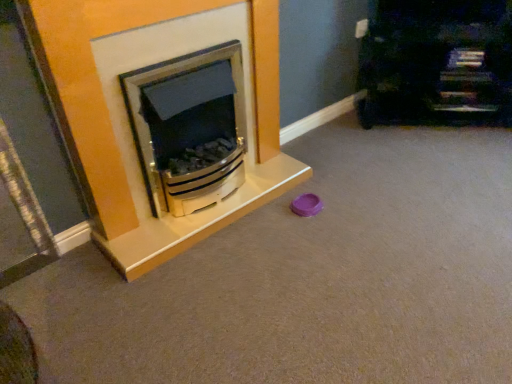
Locate an element on the screen. Image resolution: width=512 pixels, height=384 pixels. matte white fireplace at center is located at coordinates 115,137.

The width and height of the screenshot is (512, 384). What do you see at coordinates (115, 137) in the screenshot?
I see `matte white fireplace at center` at bounding box center [115, 137].

This screenshot has height=384, width=512. I want to click on matte white fireplace at center, so click(x=115, y=137).